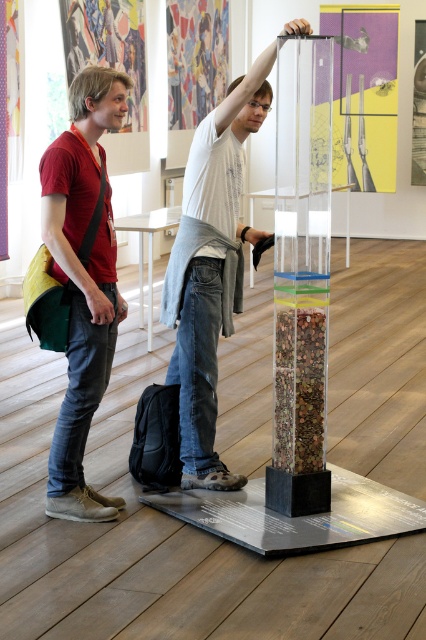
Question: Which of these objects is positioned farthest from the transparent acrylic tube at center?

Choices:
 (A) white matte shirt at center
 (B) matte red shirt at left

Answer: (B)

Question: Can you confirm if transparent acrylic tube at center is bigger than matte red shirt at left?

Choices:
 (A) yes
 (B) no

Answer: (B)

Question: Which object is closer to the camera taking this photo?

Choices:
 (A) transparent acrylic tube at center
 (B) white matte shirt at center

Answer: (B)

Question: Can you confirm if white matte shirt at center is bigger than matte red shirt at left?

Choices:
 (A) yes
 (B) no

Answer: (A)

Question: Does white matte shirt at center appear on the right side of matte red shirt at left?

Choices:
 (A) no
 (B) yes

Answer: (B)

Question: Which object is positioned farthest from the transparent acrylic tube at center?

Choices:
 (A) matte red shirt at left
 (B) white matte shirt at center

Answer: (A)